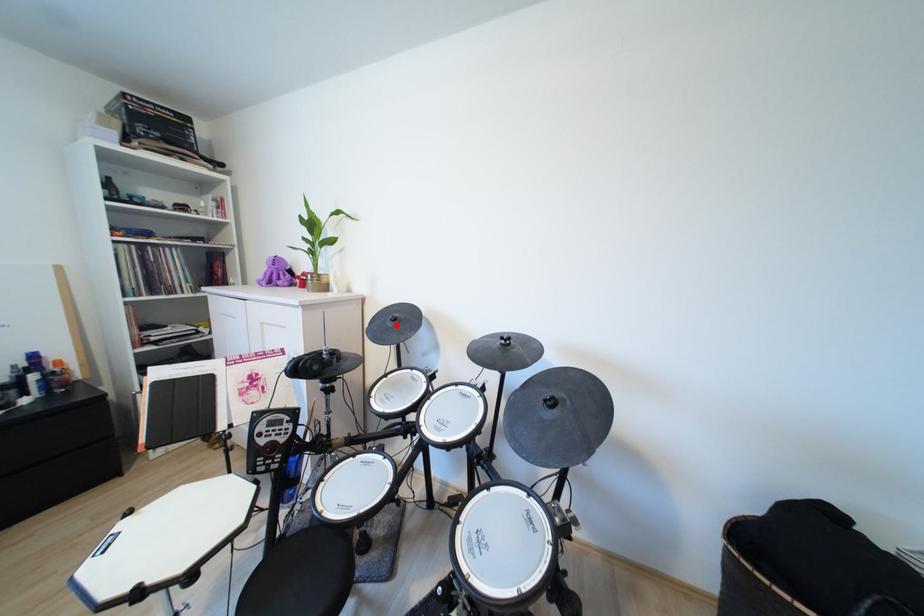
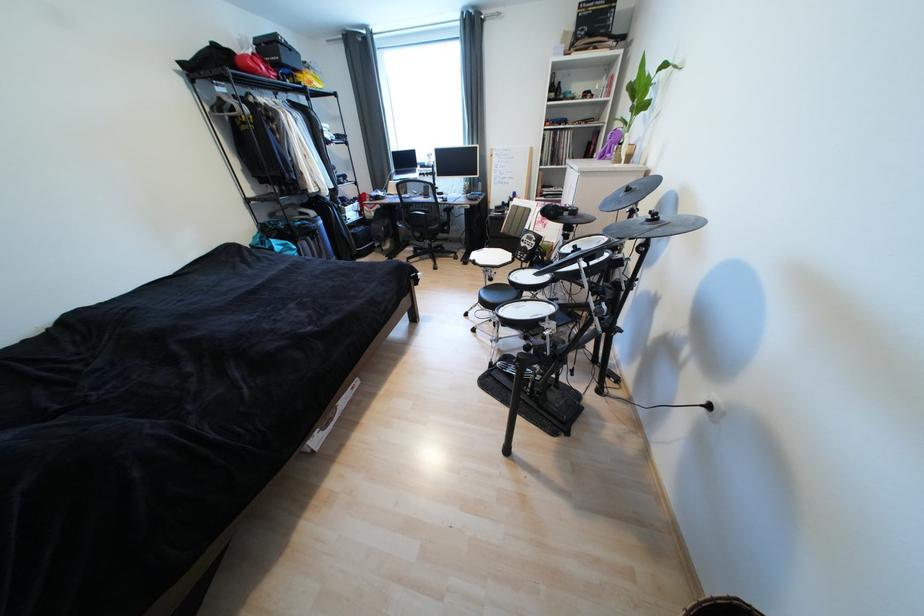
The point at the highlighted location is marked in the first image. Where is the corresponding point in the second image?

(628, 196)